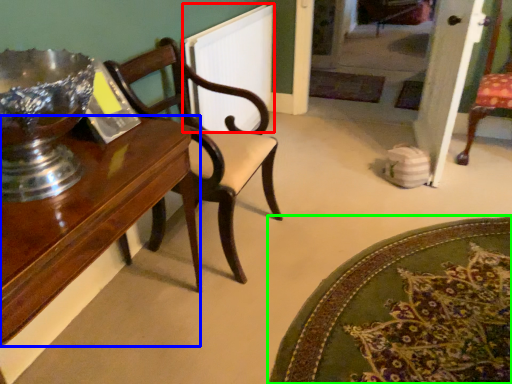
Question: Which object is positioned farthest from radiator (highlighted by a red box)? Select from table (highlighted by a blue box) and mat (highlighted by a green box).

Choices:
 (A) table
 (B) mat

Answer: (B)